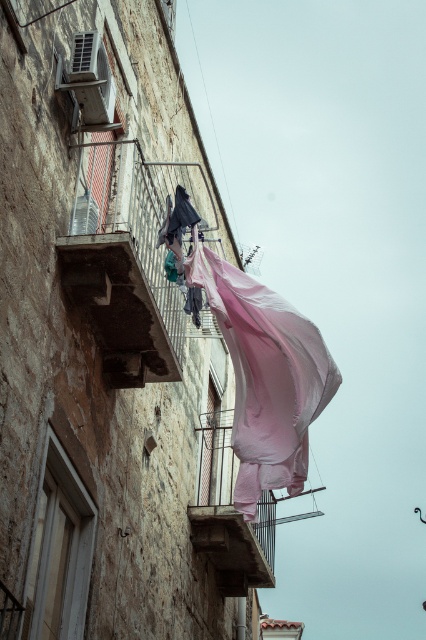
Question: Which of the following is the closest to the observer?

Choices:
 (A) metal mesh balcony at center
 (B) matte pink fabric at upper left

Answer: (B)

Question: Which object appears farthest from the camera in this image?

Choices:
 (A) metal mesh balcony at center
 (B) rusty metal balcony at center
 (C) matte pink fabric at upper left

Answer: (A)

Question: Does rusty metal balcony at center appear on the right side of metal mesh balcony at center?

Choices:
 (A) no
 (B) yes

Answer: (A)

Question: Can you confirm if rusty metal balcony at center is wider than metal mesh balcony at center?

Choices:
 (A) yes
 (B) no

Answer: (A)

Question: Does metal mesh balcony at center have a lesser width compared to matte pink fabric at upper left?

Choices:
 (A) yes
 (B) no

Answer: (B)

Question: Which object is the closest to the rusty metal balcony at center?

Choices:
 (A) metal mesh balcony at center
 (B) matte pink fabric at upper left

Answer: (B)